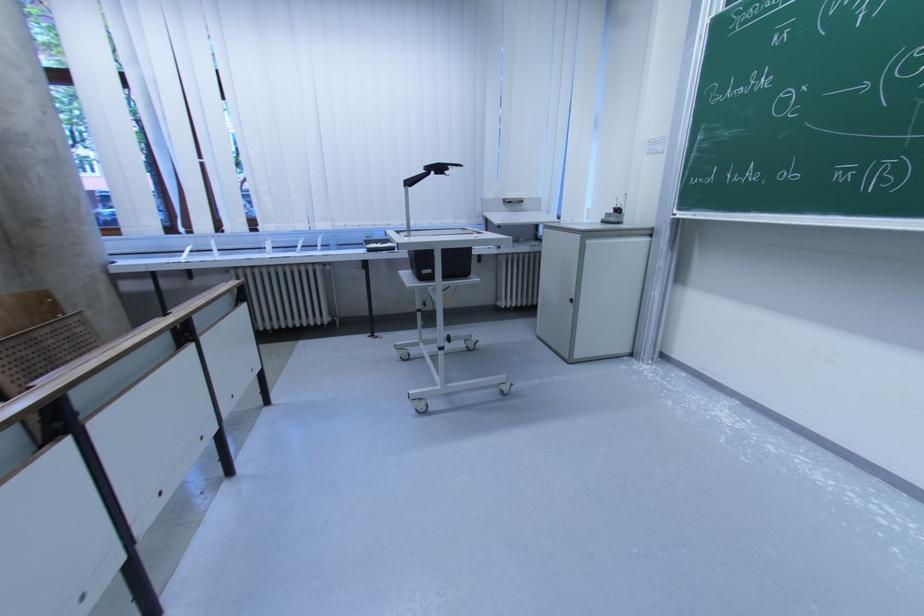
Locate an element on the screen. blind adjustment wand is located at coordinates (415, 180).